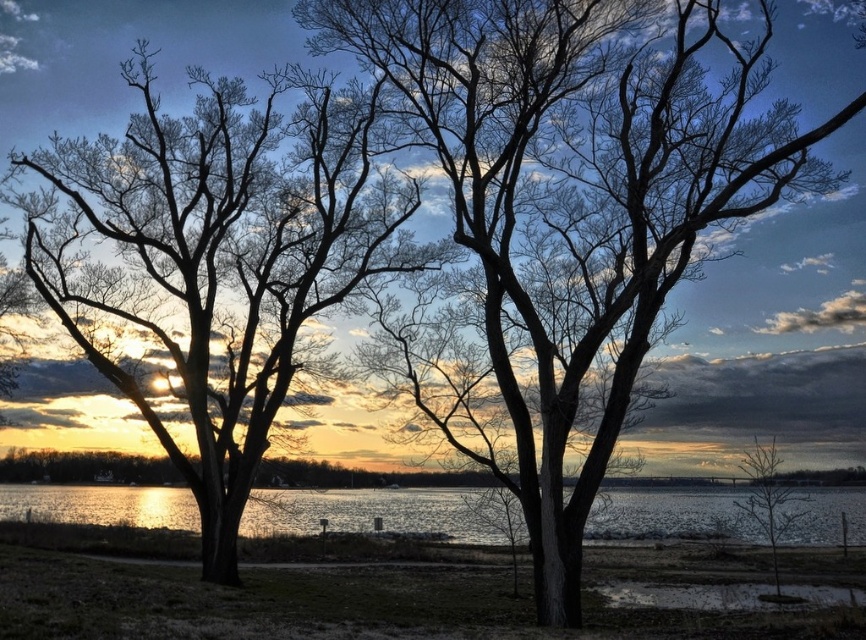
Question: Can you confirm if glistening water at center is positioned above bare branches at lower right?

Choices:
 (A) no
 (B) yes

Answer: (A)

Question: In this image, where is glistening water at center located relative to bare branches at lower right?

Choices:
 (A) right
 (B) left

Answer: (B)

Question: Is smooth bark tree at center positioned at the back of bare branches at lower right?

Choices:
 (A) yes
 (B) no

Answer: (B)

Question: Considering the real-world distances, which object is closest to the glistening water at center?

Choices:
 (A) smooth bark tree at center
 (B) silhouette bark tree at center

Answer: (A)

Question: Among these points, which one is farthest from the camera?

Choices:
 (A) (251, 180)
 (B) (606, 44)
 (C) (750, 531)
 (D) (763, 486)

Answer: (C)

Question: Which point is closer to the camera taking this photo?

Choices:
 (A) (44, 241)
 (B) (808, 500)
 (C) (864, 522)
 (D) (621, 237)

Answer: (D)